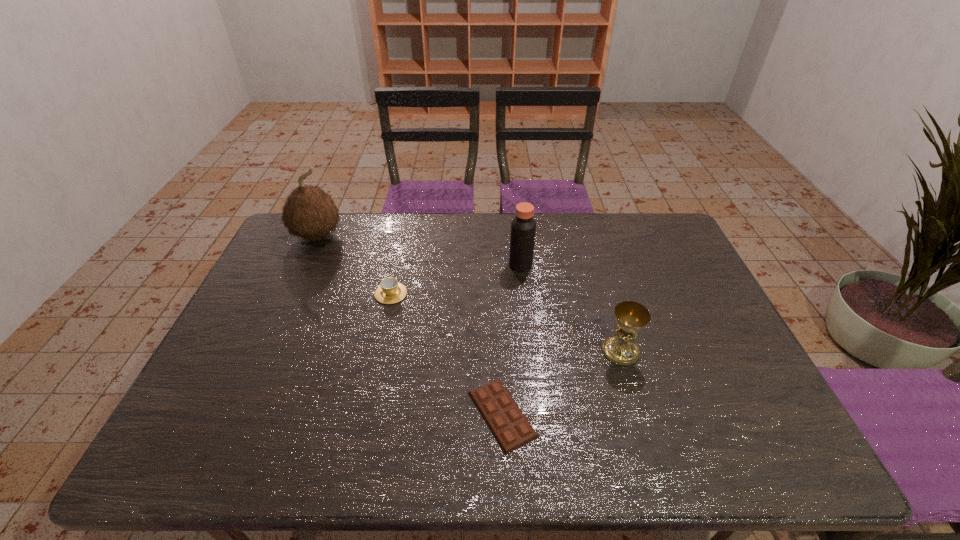
Identify the location of object that is at the far left corner. (309, 212).

I want to click on vacant space at the far edge, so click(369, 217).

In the image, there is a desktop. Where is `vacant area at the near edge`? vacant area at the near edge is located at coordinates (302, 435).

Image resolution: width=960 pixels, height=540 pixels. In the image, there is a desktop. In order to click on vacant space at the left edge in this screenshot , I will do `click(292, 285)`.

Find the location of a particular element. The height and width of the screenshot is (540, 960). vacant space at the right edge of the desktop is located at coordinates 680,268.

The height and width of the screenshot is (540, 960). Identify the location of free space at the far right corner. (677, 250).

Identify the location of free point between the vinegar and the second nearest object. This screenshot has height=540, width=960. (570, 308).

Locate an element on the screen. free area in between the chocolate bar and the third nearest object is located at coordinates (446, 354).

This screenshot has height=540, width=960. Identify the location of empty space between the chocolate bar and the rightmost object. (562, 382).

This screenshot has width=960, height=540. In order to click on free spot between the leftmost object and the fourth farthest object in this screenshot , I will do `click(468, 294)`.